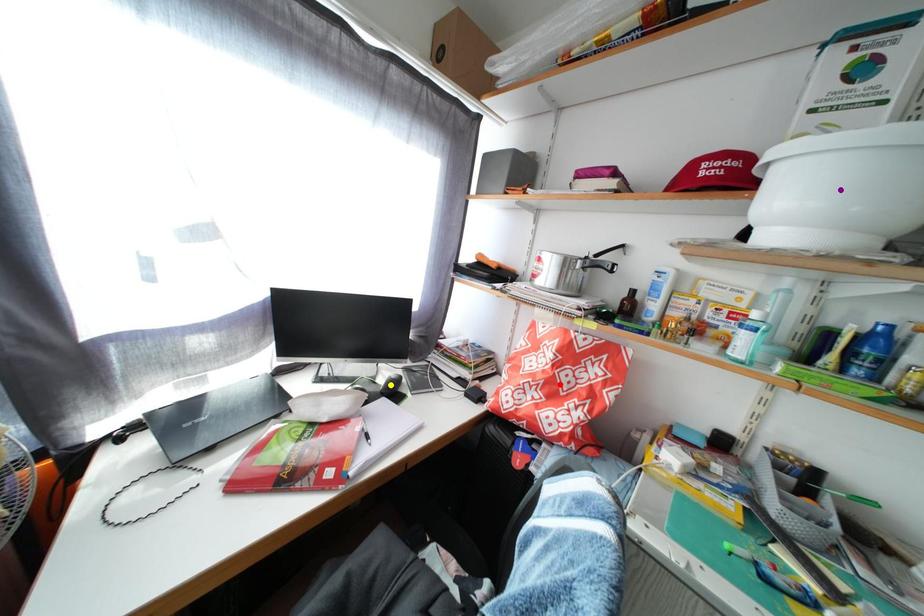
Order these from nearest to farthest:
red point | purple point | yellow point

purple point < red point < yellow point